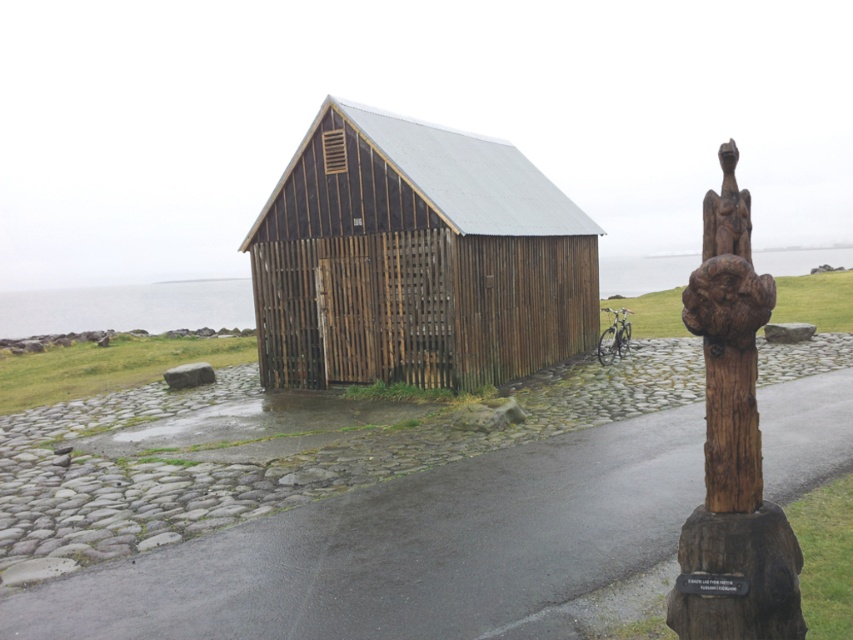
Is point (706, 500) farther from camera compared to point (728, 188)?

No, it is not.

Does carved wooden totem pole at right come in front of brown wooden carving at upper right?

That is True.

Between point (711, 460) and point (735, 241), which one is positioned in front?

Point (711, 460) is more forward.

Find the location of a particular element. carved wooden totem pole at right is located at coordinates (732, 448).

Is dark brown wooden barn at center in front of carved wooden totem pole at right?

No, it is behind carved wooden totem pole at right.

Between point (283, 330) and point (746, 230), which one is positioned in front?

Point (746, 230)

Does point (434, 346) come in front of point (752, 333)?

No, (434, 346) is further to viewer.

You are a GUI agent. You are given a task and a screenshot of the screen. Output one action in this format:
    pyautogui.click(x=<x>, y=<y>)
    Task: Click on the dark brown wooden barn at center
    The width and height of the screenshot is (853, 640).
    Given the screenshot: What is the action you would take?
    pyautogui.click(x=418, y=259)

Which of these two, dark brown wooden barn at center or brown wooden carving at upper right, stands shorter?

brown wooden carving at upper right is shorter.

Can you confirm if dark brown wooden barn at center is thinner than brown wooden carving at upper right?

No.

Is point (438, 330) positioned after point (708, 214)?

Yes, it is.

Locate an element on the screen. This screenshot has width=853, height=640. dark brown wooden barn at center is located at coordinates (418, 259).